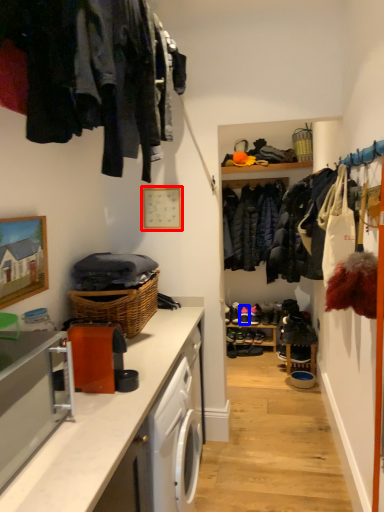
Question: Which object is closer to the camera taking this photo, picture frame (highlighted by a red box) or shoe (highlighted by a blue box)?

Choices:
 (A) picture frame
 (B) shoe

Answer: (A)